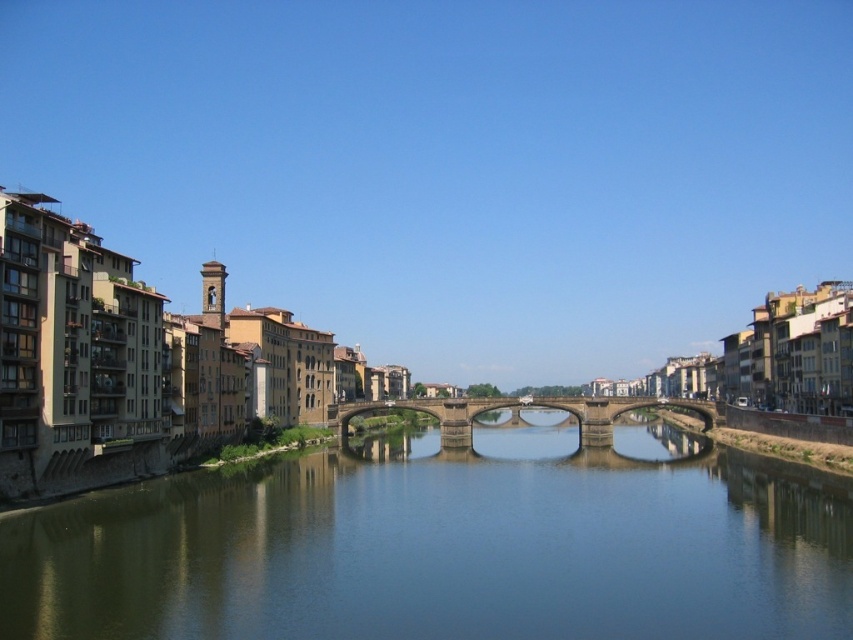
Is point (395, 524) farther from viewer compared to point (608, 444)?

That is False.

Does point (753, 476) come closer to viewer compared to point (334, 426)?

Yes, it is.

Where is `greenish-blue water at center`? Image resolution: width=853 pixels, height=640 pixels. greenish-blue water at center is located at coordinates (440, 547).